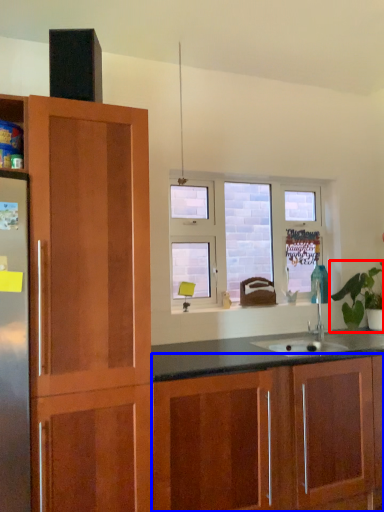
Question: Which object appears closest to the camera in this image, houseplant (highlighted by a red box) or cabinetry (highlighted by a blue box)?

Choices:
 (A) houseplant
 (B) cabinetry

Answer: (B)